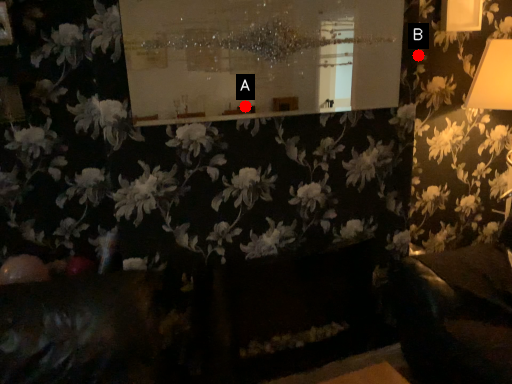
Question: Two points are circled on the image, labeled by A and B beside each circle. Which of the following is the closest to the observer?

Choices:
 (A) A is closer
 (B) B is closer

Answer: (A)